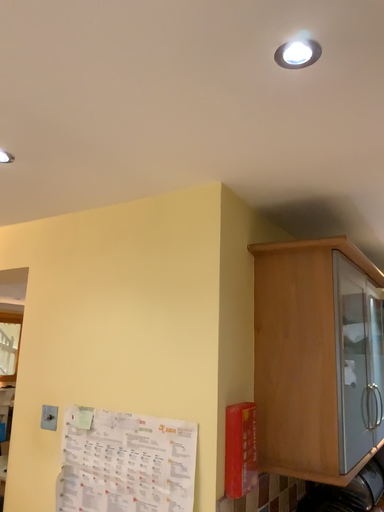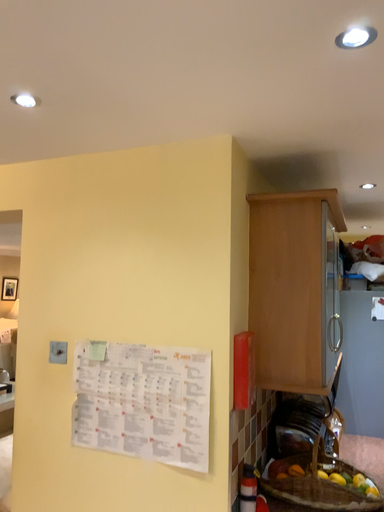
Question: Which way did the camera rotate in the video?

Choices:
 (A) rotated downward
 (B) rotated upward

Answer: (A)